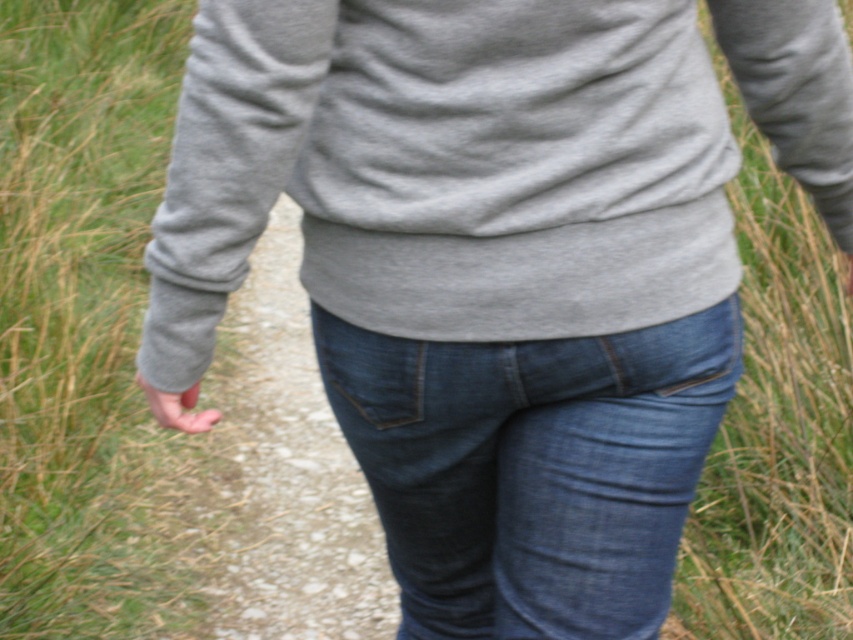
Can you confirm if denim pants at lower center is thinner than matte gray hand at lower left?

No.

Can you confirm if denim pants at lower center is bigger than matte gray hand at lower left?

Yes, denim pants at lower center is bigger than matte gray hand at lower left.

Is point (231, 561) positioned after point (149, 410)?

No, (231, 561) is closer to viewer.

Identify the location of denim pants at lower center. (294, 476).

Measure the distance between gray cotton sweatshirt at center and camera.

38.63 inches

Can you confirm if gray cotton sweatshirt at center is positioned above denim at center?

Yes, gray cotton sweatshirt at center is above denim at center.

Who is more distant from viewer, (573, 228) or (341, 353)?

Point (341, 353)

Locate an element on the screen. gray cotton sweatshirt at center is located at coordinates (445, 168).

How much distance is there between denim pants at lower center and matte pink skin at lower center?

6.90 feet

Is denim pants at lower center thinner than matte pink skin at lower center?

In fact, denim pants at lower center might be wider than matte pink skin at lower center.

Does point (264, 428) come behind point (846, 257)?

Yes, it is behind point (846, 257).

Identify the location of denim pants at lower center. This screenshot has height=640, width=853. (294, 476).